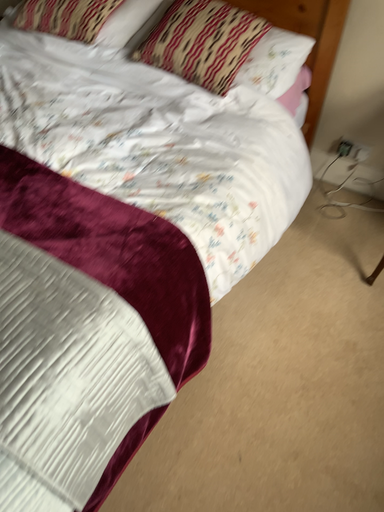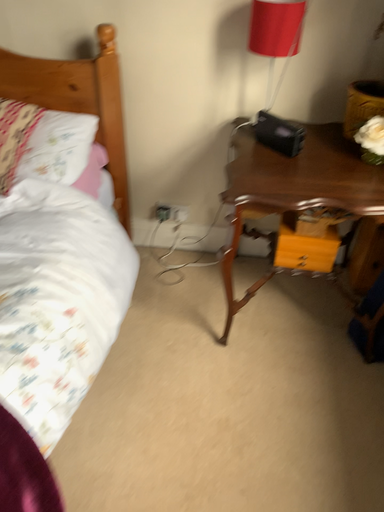
Question: Which way did the camera rotate in the video?

Choices:
 (A) rotated left
 (B) rotated right

Answer: (B)